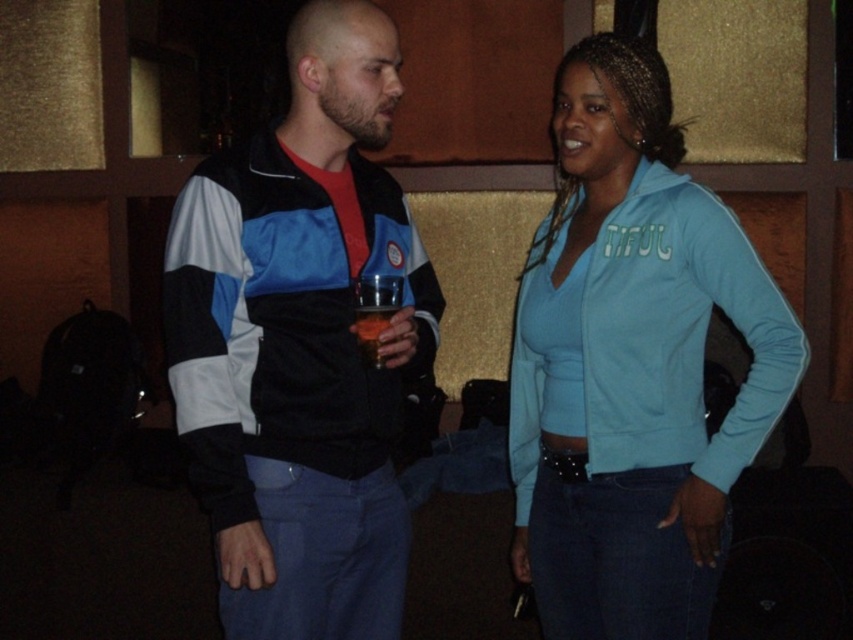
Does matte black jacket at center have a lesser height compared to translucent plastic cup at center?

Incorrect, matte black jacket at center's height does not fall short of translucent plastic cup at center's.

Can you confirm if matte black jacket at center is thinner than translucent plastic cup at center?

In fact, matte black jacket at center might be wider than translucent plastic cup at center.

Locate an element on the screen. matte black jacket at center is located at coordinates (300, 342).

Can you confirm if light blue fleece jacket at center is thinner than translucent plastic cup at center?

No.

Between light blue fleece jacket at center and translucent plastic cup at center, which one is positioned lower?

light blue fleece jacket at center is below.

Between point (558, 266) and point (357, 339), which one is positioned behind?

Point (558, 266)

Where is `light blue fleece jacket at center`? The width and height of the screenshot is (853, 640). light blue fleece jacket at center is located at coordinates (631, 364).

Does matte black jacket at center have a lesser width compared to light blue fleece jacket at center?

No, matte black jacket at center is not thinner than light blue fleece jacket at center.

Image resolution: width=853 pixels, height=640 pixels. Describe the element at coordinates (300, 342) in the screenshot. I see `matte black jacket at center` at that location.

Is point (329, 273) in front of point (601, 268)?

Yes, it is in front of point (601, 268).

The width and height of the screenshot is (853, 640). In order to click on matte black jacket at center in this screenshot , I will do `click(300, 342)`.